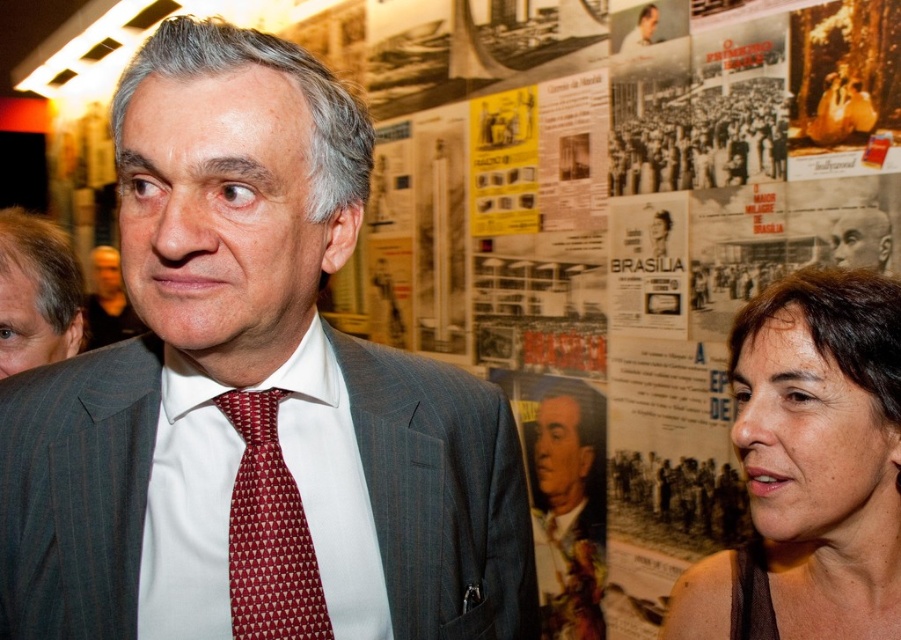
You are a fashion designer observing the man in the scene. You need to determine the spatial arrangement of his clothing items. Is the smooth dark suit at center positioned to the left or right of the smooth white shirt at upper center?

The smooth dark suit at center is to the left of the smooth white shirt at upper center according to the description.

You are a photographer taking a picture of the man in the scene. You notice the dark gray pinstripe suit at center and the matte red tie at center. Which object is positioned closer to the camera?

The dark gray pinstripe suit at center is closer to the viewer than the matte red tie at center, so the dark gray pinstripe suit at center would be positioned closer to the camera.

You are standing in the scene and want to move from the point at coordinates point (x=114, y=125) to the point at coordinates point (x=112, y=305). Which direction should you face to walk towards the second point?

To move from point (x=114, y=125) to point (x=112, y=305), you should face east because point (x=112, y=305) is to the east of point (x=114, y=125).